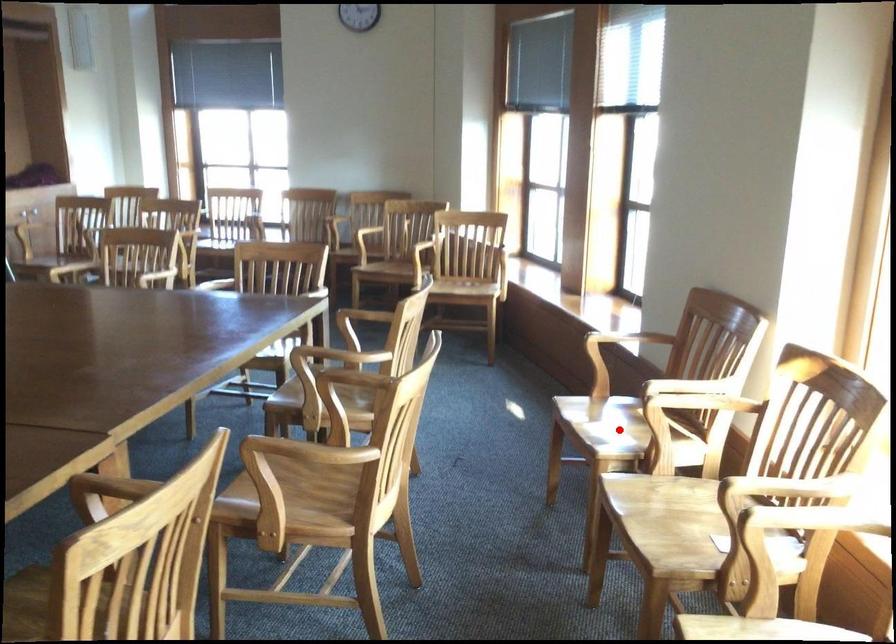
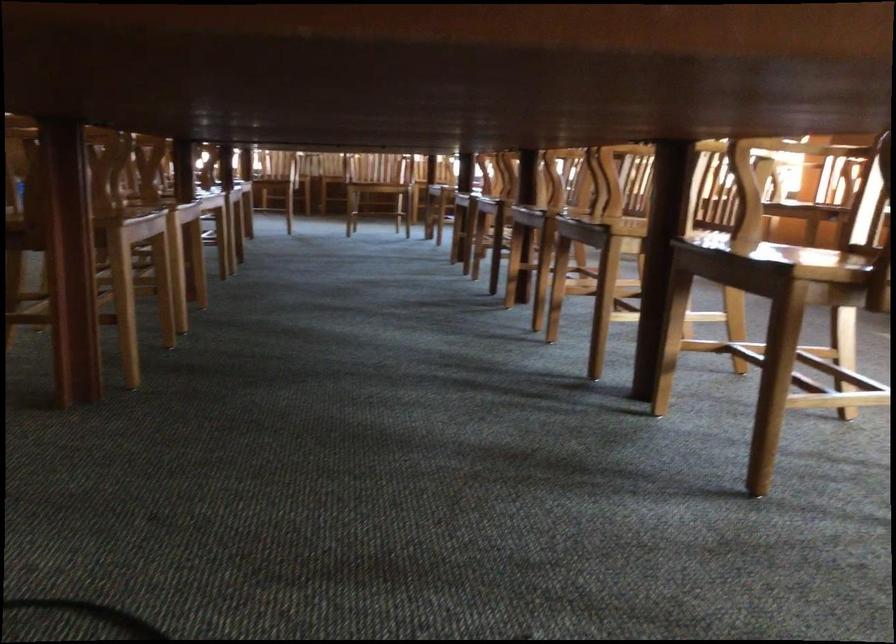
Question: I am providing you with two images of the same scene from different viewpoints. A red point is marked on the first image. Is the red point's position out of view in image 2?

Choices:
 (A) Yes
 (B) No

Answer: (A)